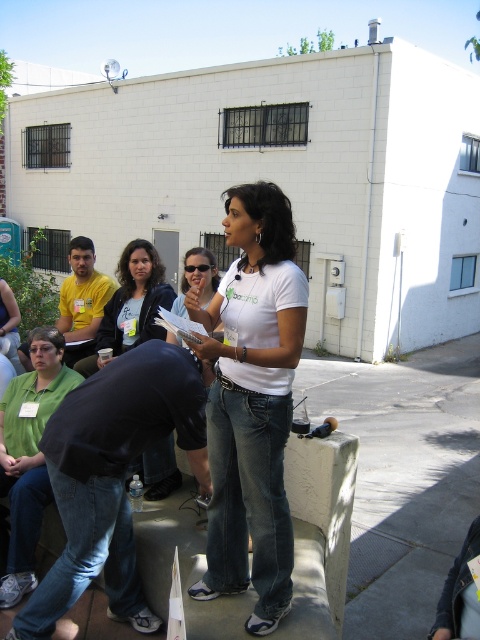
You are an event organizer and need to ensure all participants have matching shirts for the event. You notice two shirts in the scene labeled as white matte shirt at center and matte white shirt at center. Which one is wider?

The white matte shirt at center is wider than the matte white shirt at center according to the description.